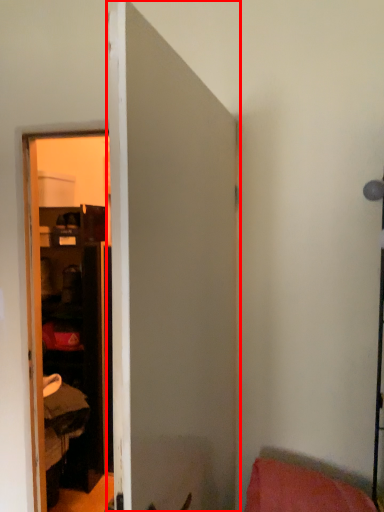
Question: From the image's perspective, where is door (annotated by the red box) located in relation to pillow in the image?

Choices:
 (A) above
 (B) below

Answer: (A)